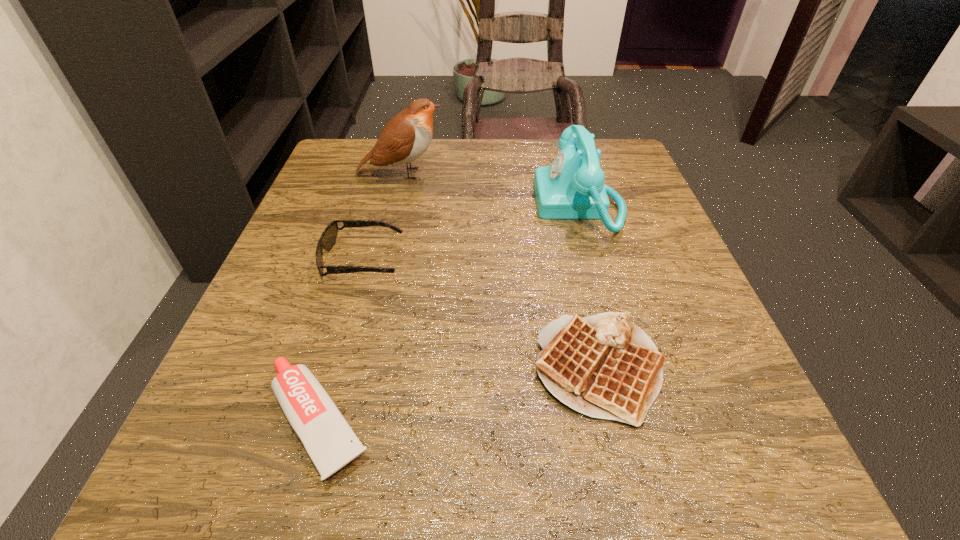
Where is `bird`? bird is located at coordinates (405, 138).

Image resolution: width=960 pixels, height=540 pixels. In order to click on telephone in this screenshot , I will do `click(572, 187)`.

In order to click on sunglasses in this screenshot , I will do `click(328, 238)`.

Identify the location of waffle. [604, 366].

The width and height of the screenshot is (960, 540). In order to click on toothpaste in this screenshot , I will do `click(330, 442)`.

I want to click on free space located 0.310m at the face of the bird, so click(x=586, y=173).

Identify the location of vacant space located 0.120m on the dial of the telephone. Image resolution: width=960 pixels, height=540 pixels. (477, 205).

The height and width of the screenshot is (540, 960). I want to click on free space located on the dial of the telephone, so click(x=402, y=205).

You are a GUI agent. You are given a task and a screenshot of the screen. Output one action in this format:
    pyautogui.click(x=<x>, y=<y>)
    Task: Click on the vacant point located on the dial of the telephone
    
    Given the screenshot: What is the action you would take?
    pyautogui.click(x=442, y=205)

The image size is (960, 540). Identify the location of vacant space located 0.050m on the front-facing side of the sunglasses. (430, 260).